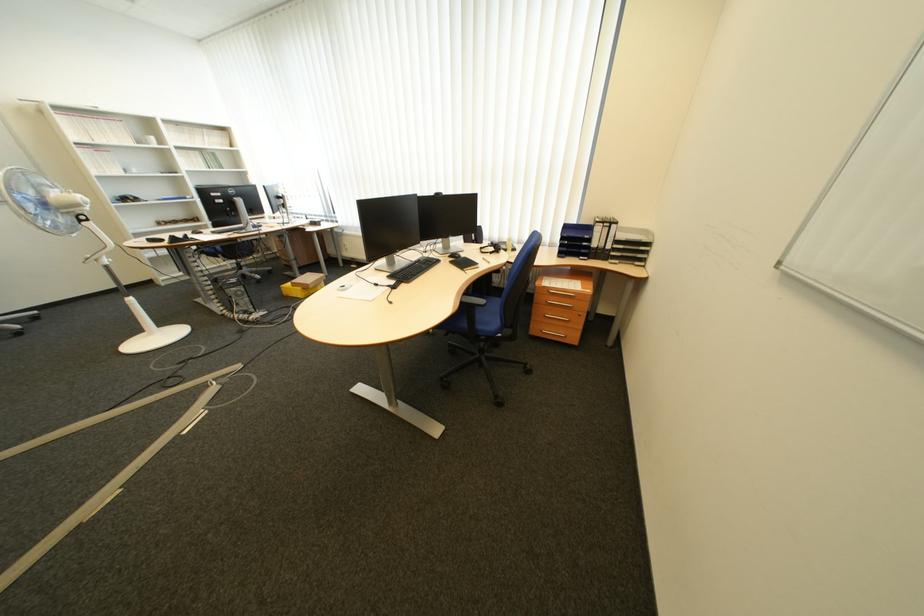
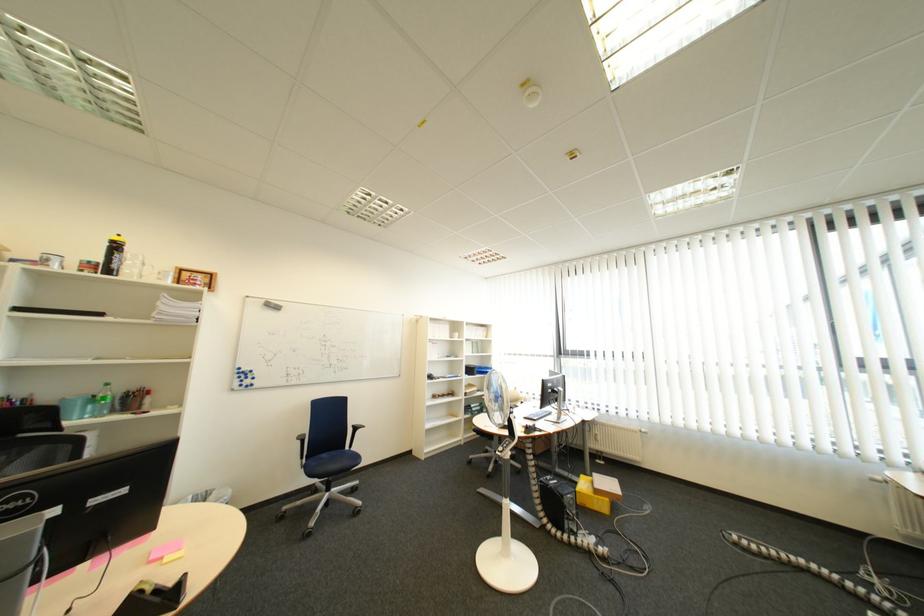
The point at (252, 294) is marked in the first image. Where is the corresponding point in the second image?

(585, 503)